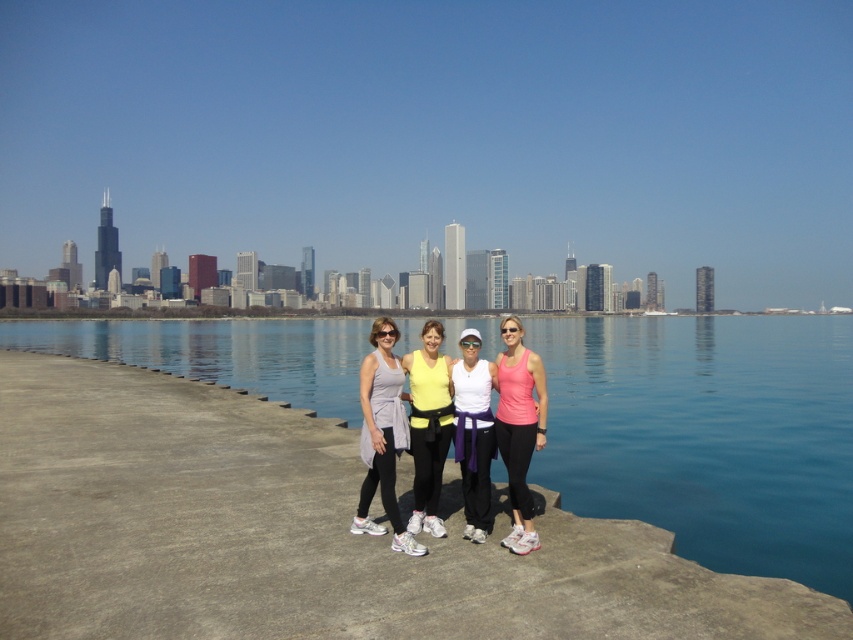
Is matte gray tank top at center to the right of matte yellow tank top at center from the viewer's perspective?

In fact, matte gray tank top at center is to the left of matte yellow tank top at center.

What do you see at coordinates (381, 435) in the screenshot? I see `matte gray tank top at center` at bounding box center [381, 435].

Where is `matte gray tank top at center`? matte gray tank top at center is located at coordinates (381, 435).

Describe the element at coordinates (519, 428) in the screenshot. The width and height of the screenshot is (853, 640). I see `pink matte tank top at center` at that location.

Is pink matte tank top at center taller than matte yellow tank top at center?

Indeed, pink matte tank top at center has a greater height compared to matte yellow tank top at center.

I want to click on pink matte tank top at center, so coord(519,428).

Identify the location of pink matte tank top at center. The image size is (853, 640). (519, 428).

Who is more distant from viewer, (718, 556) or (416, 492)?

Point (718, 556)

In the scene shown: Between blue smooth water at center and matte yellow tank top at center, which one is positioned lower?

matte yellow tank top at center

Between point (465, 321) and point (419, 442), which one is positioned behind?

The point (465, 321) is more distant.

Find the location of a particular element. blue smooth water at center is located at coordinates (708, 435).